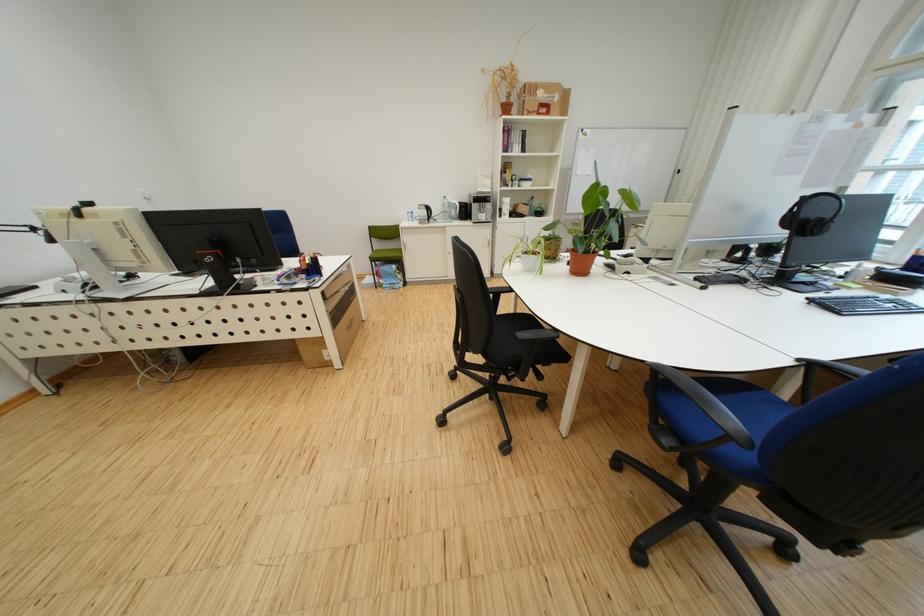
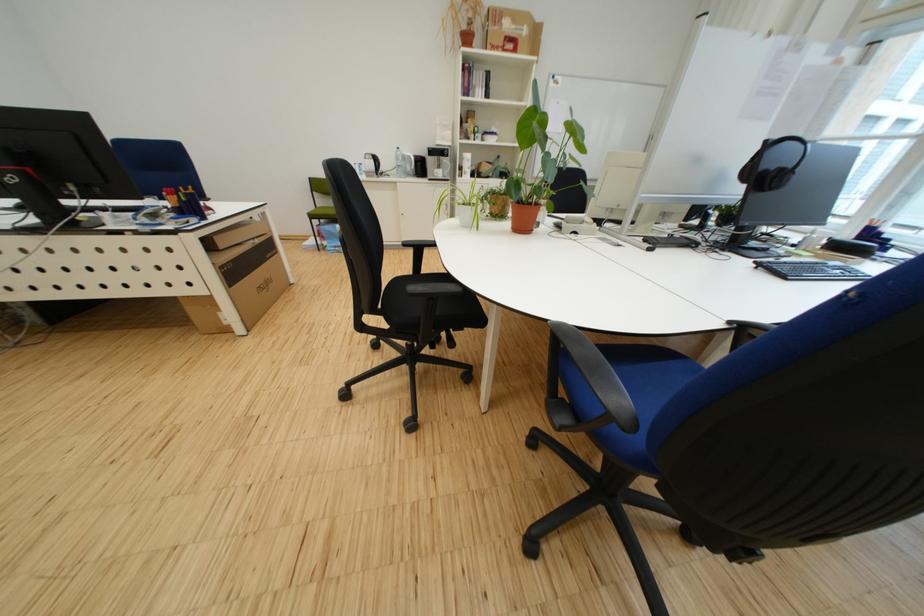
Find the pixel in the second image that matches pixel 383 262 in the first image.

(323, 219)